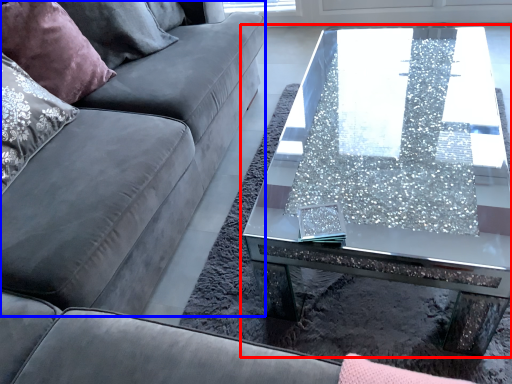
Question: Which object appears closest to the camera in this image, coffee table (highlighted by a red box) or couch (highlighted by a blue box)?

Choices:
 (A) coffee table
 (B) couch

Answer: (B)